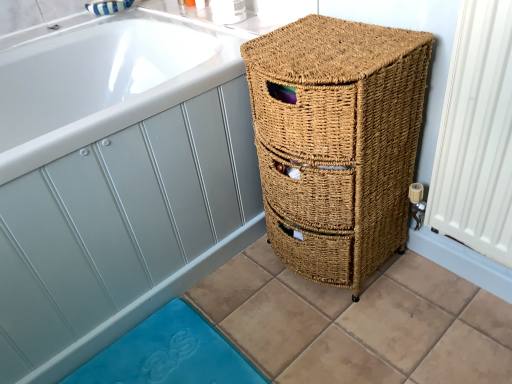
Question: Is natural woven basket at right wider than natural woven basket at right?

Choices:
 (A) no
 (B) yes

Answer: (A)

Question: From a real-world perspective, does natural woven basket at right sit lower than natural woven basket at right?

Choices:
 (A) no
 (B) yes

Answer: (A)

Question: Is natural woven basket at right at the back of natural woven basket at right?

Choices:
 (A) yes
 (B) no

Answer: (B)

Question: Can you confirm if natural woven basket at right is positioned to the right of natural woven basket at right?

Choices:
 (A) yes
 (B) no

Answer: (A)

Question: Is natural woven basket at right next to natural woven basket at right and touching it?

Choices:
 (A) no
 (B) yes

Answer: (A)

Question: Considering the positions of point (392, 51) and point (108, 370), is point (392, 51) closer or farther from the camera than point (108, 370)?

Choices:
 (A) farther
 (B) closer

Answer: (B)

Question: Do you think natural woven basket at right is within blue rubber bath mat at lower left, or outside of it?

Choices:
 (A) inside
 (B) outside

Answer: (B)

Question: Looking at their shapes, would you say natural woven basket at right is wider or thinner than blue rubber bath mat at lower left?

Choices:
 (A) wide
 (B) thin

Answer: (B)

Question: Looking at the image, does natural woven basket at right seem bigger or smaller compared to blue rubber bath mat at lower left?

Choices:
 (A) big
 (B) small

Answer: (A)

Question: From the image's perspective, is blue rubber bath mat at lower left above or below natural woven basket at right?

Choices:
 (A) above
 (B) below

Answer: (B)

Question: Is blue rubber bath mat at lower left to the left or to the right of natural woven basket at right in the image?

Choices:
 (A) right
 (B) left

Answer: (B)

Question: From a real-world perspective, is blue rubber bath mat at lower left positioned above or below natural woven basket at right?

Choices:
 (A) below
 (B) above

Answer: (A)

Question: Relative to natural woven basket at right, is blue rubber bath mat at lower left in front or behind?

Choices:
 (A) behind
 (B) front

Answer: (A)

Question: Looking at their shapes, would you say natural woven basket at right is wider or thinner than natural woven basket at right?

Choices:
 (A) wide
 (B) thin

Answer: (A)

Question: Is natural woven basket at right in front of or behind natural woven basket at right in the image?

Choices:
 (A) behind
 (B) front

Answer: (B)